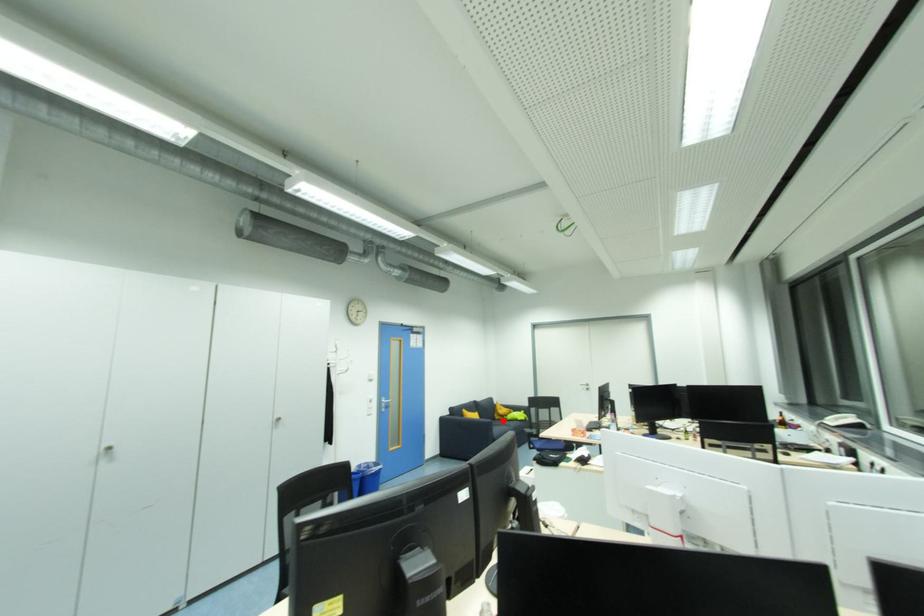
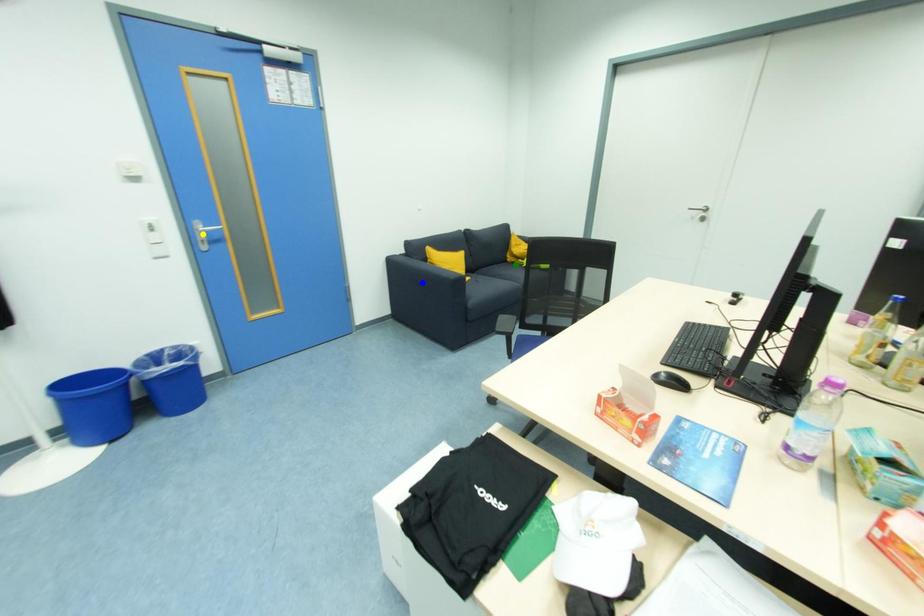
Question: I am providing you with two images of the same scene from different viewpoints. A red point is marked on the first image. You are given multiple points on the second image. Which point in image 2 represents the same 3d spot as the red point in image 1?

Choices:
 (A) blue point
 (B) yellow point
 (C) green point

Answer: (C)